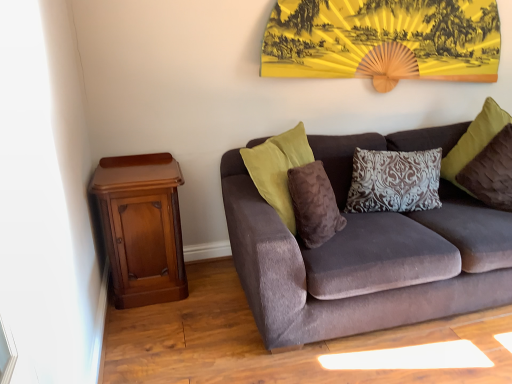
You are a GUI agent. You are given a task and a screenshot of the screen. Output one action in this format:
    pyautogui.click(x=<x>, y=<y>)
    Task: Click on the vacant space underneath yellow paper fan at upper center (from a real-world perspective)
    
    Given the screenshot: What is the action you would take?
    pyautogui.click(x=379, y=116)